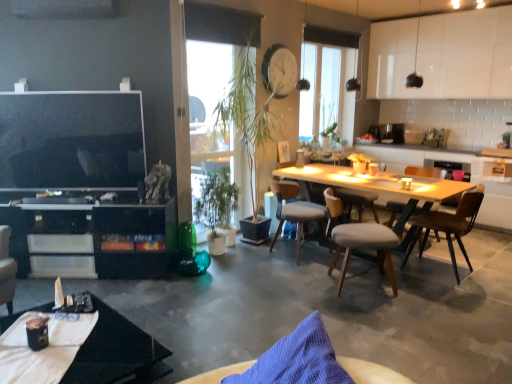
Locate an element on the screen. The height and width of the screenshot is (384, 512). vacant space situated above black glass coffee table at lower left (from a real-world perspective) is located at coordinates (58, 343).